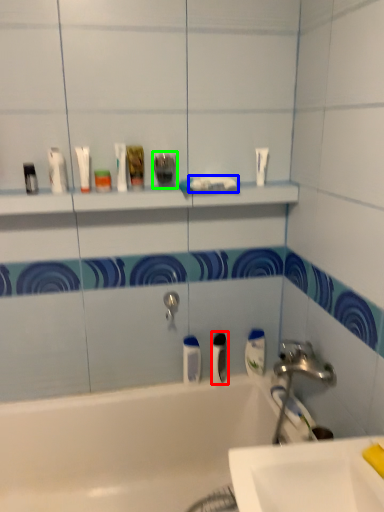
Question: Estimate the real-world distances between objects in this image. Which object is closer to mouthwash (highlighted by a red box), toothpaste (highlighted by a blue box) or toiletry (highlighted by a green box)?

Choices:
 (A) toothpaste
 (B) toiletry

Answer: (A)